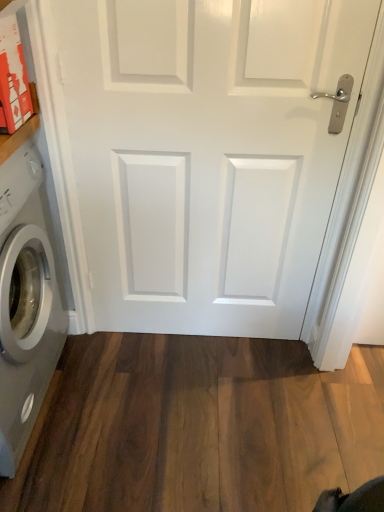
In order to face brown wood flooring at lower center, should I rotate leftwards or rightwards?

You should rotate left by 1.807 degrees.

The height and width of the screenshot is (512, 384). What do you see at coordinates (204, 154) in the screenshot?
I see `white glossy door at center` at bounding box center [204, 154].

Measure the distance between point (x=117, y=173) and camera.

A distance of 1.36 meters exists between point (x=117, y=173) and camera.

Describe the element at coordinates (25, 304) in the screenshot. I see `white plastic washing machine at left` at that location.

Locate an element on the screen. brown wood flooring at lower center is located at coordinates (199, 426).

From the image's perspective, does white glossy door at center appear lower than white plastic washing machine at left?

Actually, white glossy door at center appears above white plastic washing machine at left in the image.

Between white glossy door at center and white plastic washing machine at left, which one has less height?

Standing shorter between the two is white plastic washing machine at left.

Does white glossy door at center appear on the left side of white plastic washing machine at left?

Incorrect, white glossy door at center is not on the left side of white plastic washing machine at left.

Consider the image. Considering the relative sizes of brown wood flooring at lower center and white plastic washing machine at left in the image provided, is brown wood flooring at lower center thinner than white plastic washing machine at left?

Incorrect, the width of brown wood flooring at lower center is not less than that of white plastic washing machine at left.

Is point (196, 457) positioned in front of point (4, 360)?

No.

Is brown wood flooring at lower center next to white plastic washing machine at left?

brown wood flooring at lower center is not next to white plastic washing machine at left, and they're not touching.

From a real-world perspective, which is physically below, brown wood flooring at lower center or white plastic washing machine at left?

In real-world perspective, brown wood flooring at lower center is lower.

Is white glossy door at center wider or thinner than brown wood flooring at lower center?

Considering their sizes, white glossy door at center looks slimmer than brown wood flooring at lower center.

Can you confirm if white glossy door at center is positioned to the left of brown wood flooring at lower center?

No, white glossy door at center is not to the left of brown wood flooring at lower center.

Consider the image. Who is smaller, white glossy door at center or brown wood flooring at lower center?

Smaller between the two is brown wood flooring at lower center.

Does brown wood flooring at lower center come behind white glossy door at center?

Yes, brown wood flooring at lower center is further from the camera.

Would you say white glossy door at center is part of brown wood flooring at lower center's contents?

That's incorrect, white glossy door at center is not inside brown wood flooring at lower center.

In the scene shown: How different are the orientations of brown wood flooring at lower center and white glossy door at center in degrees?

90 degrees.

Is brown wood flooring at lower center facing towards white glossy door at center?

No, brown wood flooring at lower center is not turned towards white glossy door at center.

Which is more to the right, white plastic washing machine at left or brown wood flooring at lower center?

From the viewer's perspective, brown wood flooring at lower center appears more on the right side.

Image resolution: width=384 pixels, height=512 pixels. I want to click on washing machine on the left of brown wood flooring at lower center, so click(25, 304).

Considering the relative positions of white plastic washing machine at left and brown wood flooring at lower center in the image provided, is white plastic washing machine at left behind brown wood flooring at lower center?

That is False.

In the scene shown: How much distance is there between white plastic washing machine at left and brown wood flooring at lower center?

white plastic washing machine at left and brown wood flooring at lower center are 19.25 inches apart from each other.

Consider the image. Is white plastic washing machine at left in front of white glossy door at center?

Yes, it is in front of white glossy door at center.

Is white plastic washing machine at left positioned far away from white glossy door at center?

No, white plastic washing machine at left is not far from white glossy door at center.

Considering the sizes of white plastic washing machine at left and white glossy door at center in the image, is white plastic washing machine at left bigger or smaller than white glossy door at center?

In the image, white plastic washing machine at left appears to be larger than white glossy door at center.

Looking at this image, from the image's perspective, is white plastic washing machine at left located above or below white glossy door at center?

Clearly, from the image's perspective, white plastic washing machine at left is below white glossy door at center.

Identify the location of washing machine located in front of the white glossy door at center. This screenshot has width=384, height=512. (25, 304).

Where is `hardwood below the white plastic washing machine at left (from the image's perspective)`? Image resolution: width=384 pixels, height=512 pixels. hardwood below the white plastic washing machine at left (from the image's perspective) is located at coordinates (199, 426).

Which object lies nearer to the anchor point white glossy door at center, brown wood flooring at lower center or white plastic washing machine at left?

Based on the image, white plastic washing machine at left appears to be nearer to white glossy door at center.

Looking at the image, which one is located closer to brown wood flooring at lower center, white glossy door at center or white plastic washing machine at left?

white plastic washing machine at left is positioned closer to the anchor brown wood flooring at lower center.

Estimate the real-world distances between objects in this image. Which object is closer to white plastic washing machine at left, brown wood flooring at lower center or white glossy door at center?

The object closer to white plastic washing machine at left is white glossy door at center.

From the image, which object appears to be farther from white plastic washing machine at left, white glossy door at center or brown wood flooring at lower center?

brown wood flooring at lower center is further to white plastic washing machine at left.

When comparing their distances from brown wood flooring at lower center, does white plastic washing machine at left or white glossy door at center seem closer?

white plastic washing machine at left is positioned closer to the anchor brown wood flooring at lower center.

Considering their positions, is white plastic washing machine at left positioned closer to white glossy door at center than brown wood flooring at lower center?

Among the two, white plastic washing machine at left is located nearer to white glossy door at center.

Identify the location of hardwood situated between white plastic washing machine at left and white glossy door at center from left to right. 199,426.